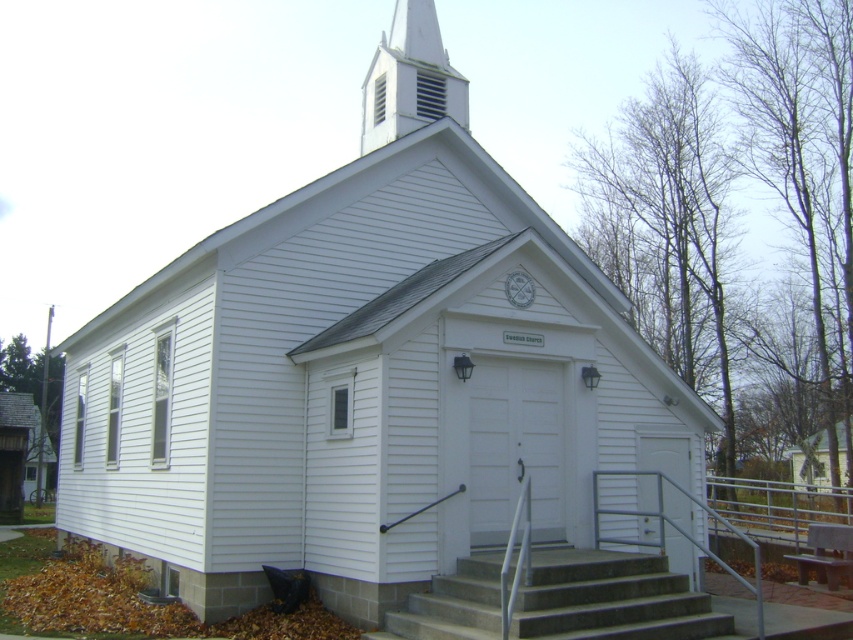
Is concrete/steps at lower center positioned behind white wood spire at upper center?

No, it is in front of white wood spire at upper center.

Is point (409, 627) in front of point (424, 54)?

Yes, it is.

Find the location of a particular element. The image size is (853, 640). concrete/steps at lower center is located at coordinates (611, 600).